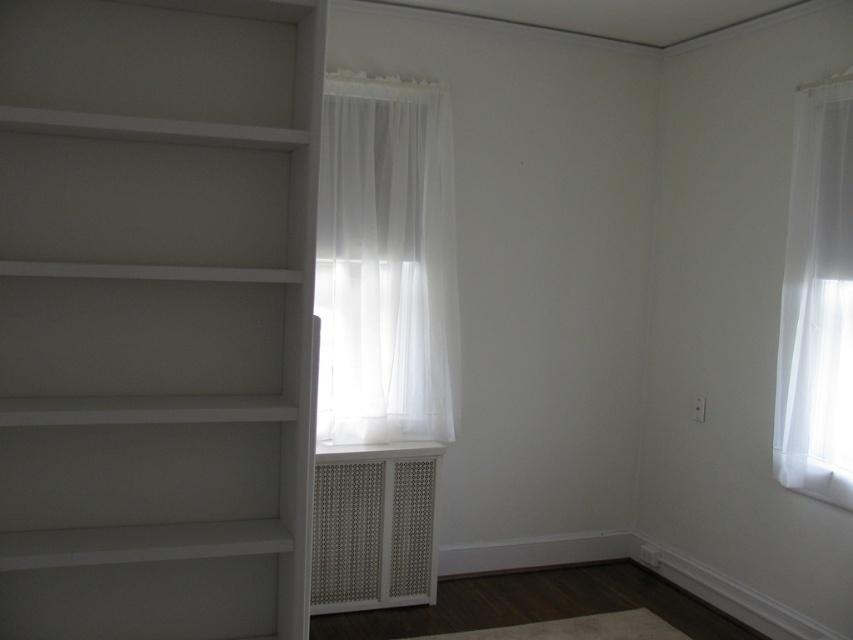
Question: Can you confirm if white painted wood bookshelf at left is positioned below sheer white curtain at right?

Choices:
 (A) no
 (B) yes

Answer: (B)

Question: Which point appears closest to the camera in this image?

Choices:
 (A) (331, 528)
 (B) (433, 317)

Answer: (A)

Question: Is sheer white curtain at center positioned behind white textured vent at center?

Choices:
 (A) yes
 (B) no

Answer: (A)

Question: Which object appears closest to the camera in this image?

Choices:
 (A) white painted wood bookshelf at left
 (B) sheer white curtain at center
 (C) white textured vent at center

Answer: (A)

Question: Which object is positioned farthest from the sheer white curtain at center?

Choices:
 (A) white textured vent at center
 (B) white painted wood bookshelf at left
 (C) sheer white curtain at right

Answer: (C)

Question: Is white painted wood bookshelf at left positioned before white textured vent at center?

Choices:
 (A) yes
 (B) no

Answer: (A)